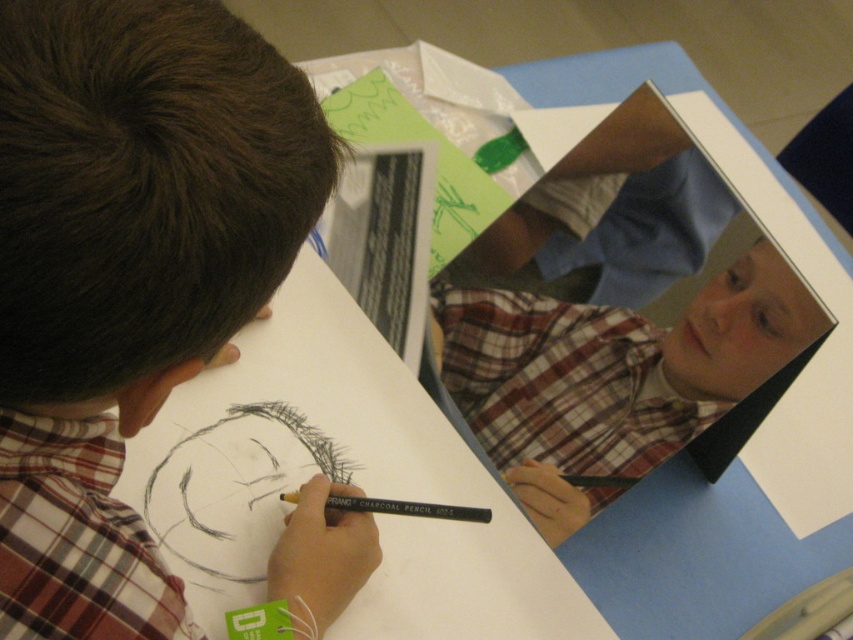
You are an artist who wants to place a new sketchbook next to the plaid shirt at upper left and the charcoal pencil at center. Based on their widths, which object should you place the sketchbook closer to to ensure it fits better?

The plaid shirt at upper left is wider than the charcoal pencil at center. Therefore, placing the sketchbook closer to the plaid shirt at upper left would provide more space for the sketchbook to fit comfortably next to both objects.

You are standing in the same room as the person drawing. You want to place a small sticker on the point that is closer to the front of the scene. Which point should you choose between point (113, 49) and point (355, 509)?

Point (113, 49) is in front of point (355, 509), so you should choose point (113, 49) to place the sticker closer to the front of the scene.

You are an art student who wants to place a small sticker between the plaid shirt at upper left and the charcoal pencil at center. Can you fit it there?

The plaid shirt at upper left is much taller than the charcoal pencil at center, so there might be enough space between them to place a small sticker.